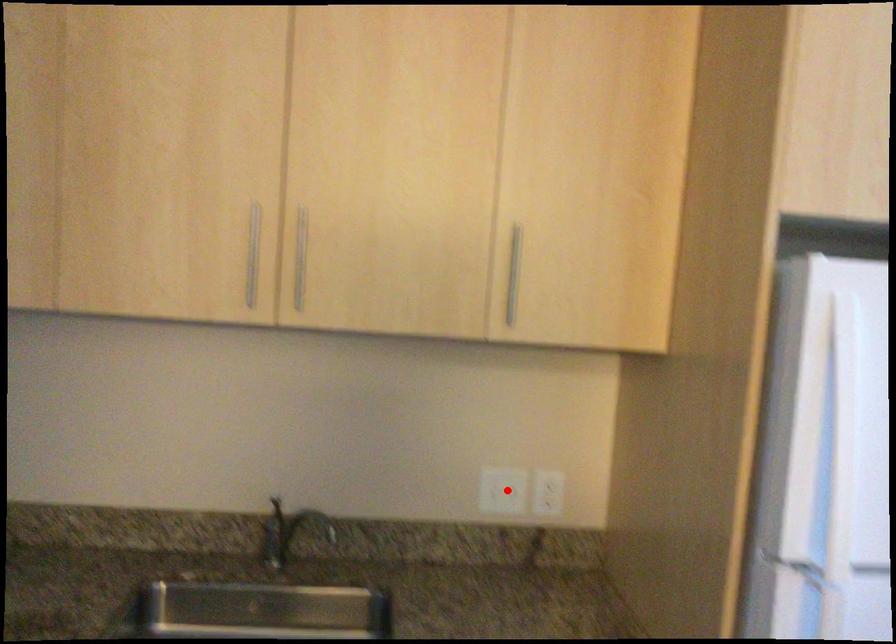
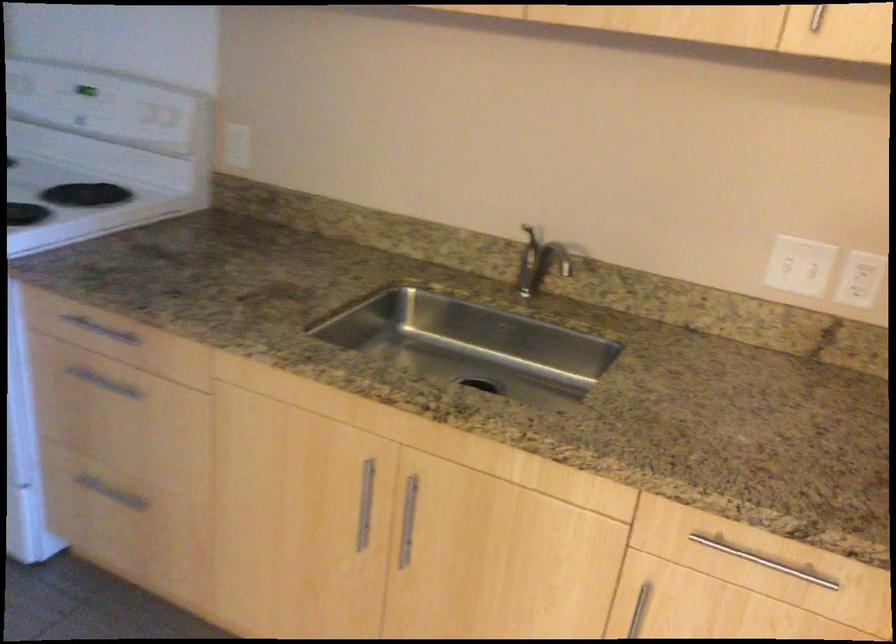
Question: A red point is marked in image1. In image2, is the corresponding 3D point closer to the camera or farther? Reply with the corresponding letter.

Choices:
 (A) The corresponding 3D point is closer.
 (B) The corresponding 3D point is farther.

Answer: (A)